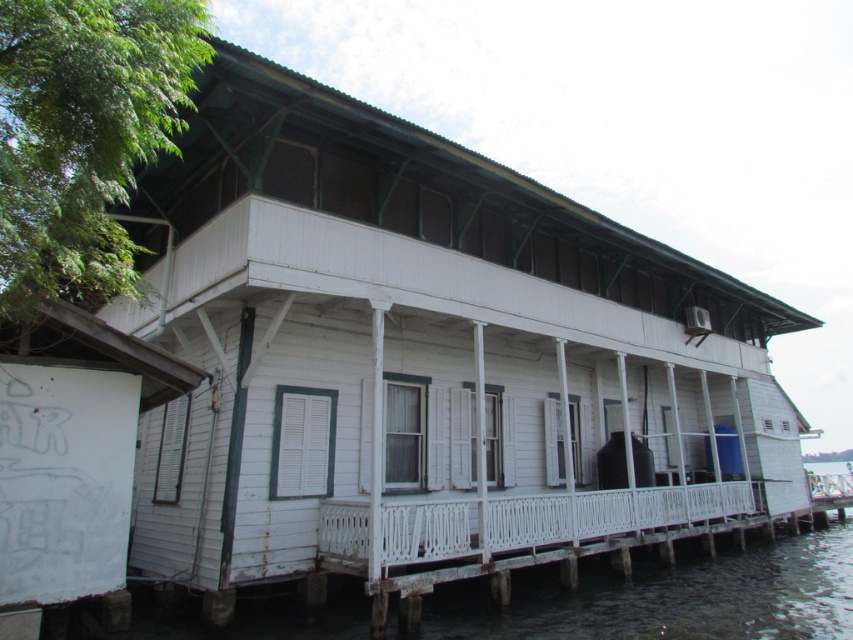
You are a visitor standing on the ground near the transparent water at lower left and want to reach the white painted wood porch at center. Which direction should you move to get there?

The transparent water at lower left is larger in size than the white painted wood porch at center. To reach the porch, you should move towards the center of the image away from the water.

You are a painter planning to paint the white painted wood porch at center and the transparent water at lower left. If you want to use the same amount of paint per square meter for both areas, which area requires more paint?

The transparent water at lower left requires more paint because its width is larger than the white painted wood porch at center, meaning it has a greater surface area.